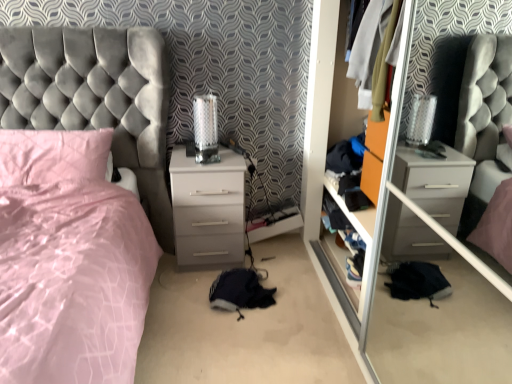
What are the coordinates of `spots to the right of wooden shelf at center` in the screenshot? It's located at (439, 301).